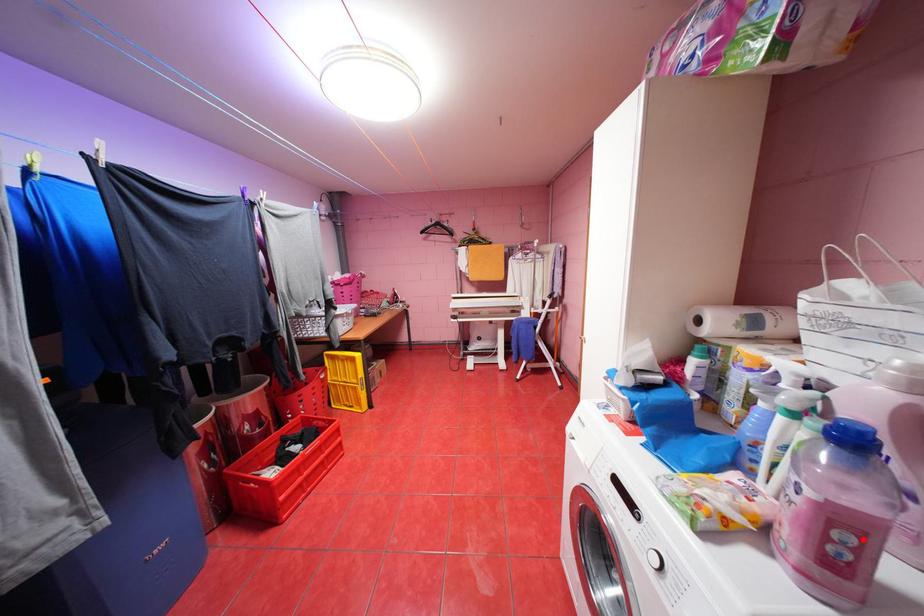
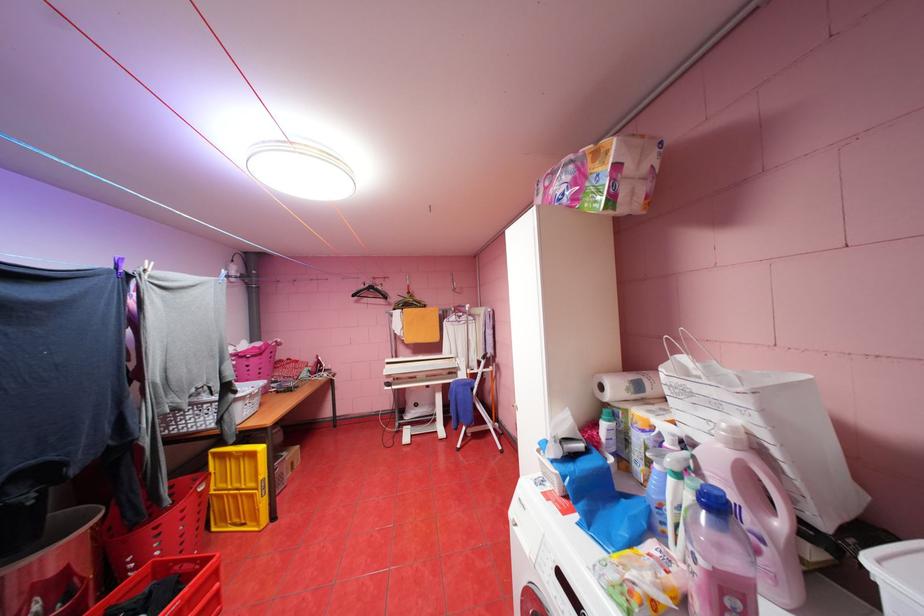
Locate, in the second image, the point that corresponds to the highlighted location in the first image.

(748, 604)